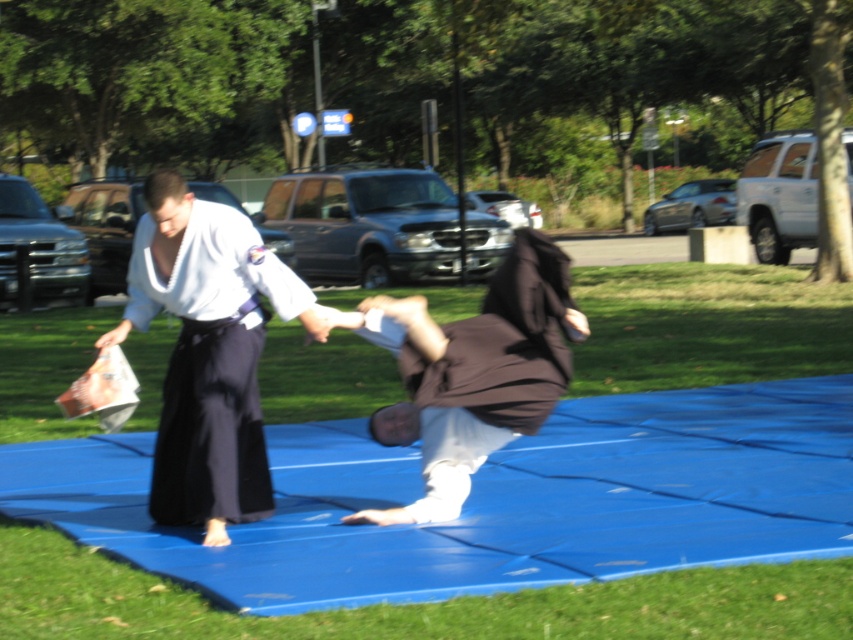
Question: Can you confirm if dark blue cotton kimono at center is wider than brown fabric monk at center?

Choices:
 (A) no
 (B) yes

Answer: (A)

Question: Which point is closer to the camera?

Choices:
 (A) (538, 260)
 (B) (158, 424)

Answer: (A)

Question: Is dark blue cotton kimono at center bigger than brown fabric monk at center?

Choices:
 (A) no
 (B) yes

Answer: (A)

Question: Which point appears closest to the camera in this image?

Choices:
 (A) (206, 332)
 (B) (535, 420)

Answer: (B)

Question: Does dark blue cotton kimono at center appear under brown fabric monk at center?

Choices:
 (A) no
 (B) yes

Answer: (A)

Question: Among these objects, which one is nearest to the camera?

Choices:
 (A) dark blue cotton kimono at center
 (B) brown fabric monk at center

Answer: (B)